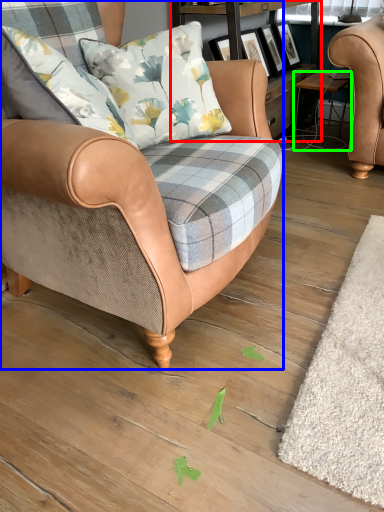
Question: Which object is the closest to the shelf (highlighted by a red box)? Choose among these: chair (highlighted by a blue box) or stool (highlighted by a green box).

Choices:
 (A) chair
 (B) stool

Answer: (B)